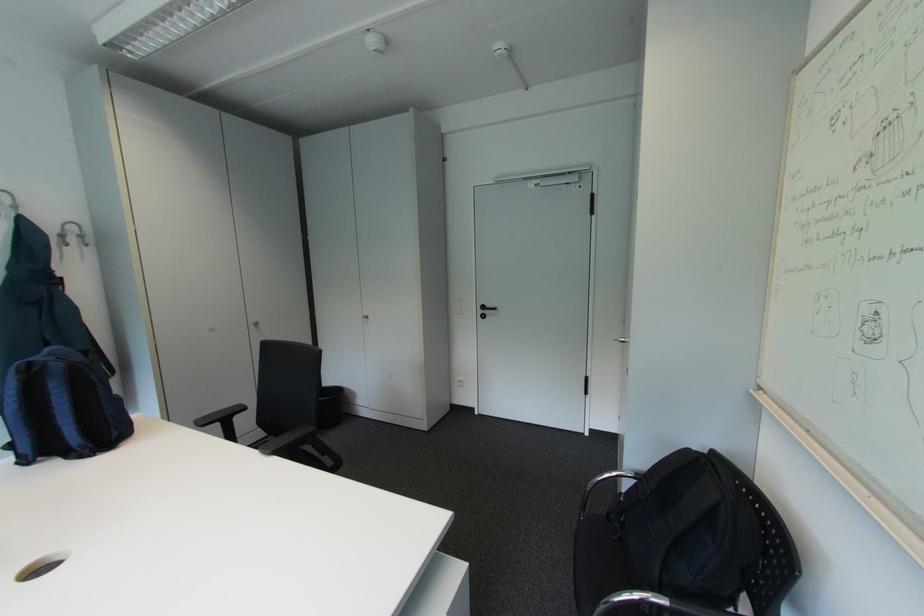
Locate an element on the screen. The image size is (924, 616). black door handle is located at coordinates (487, 310).